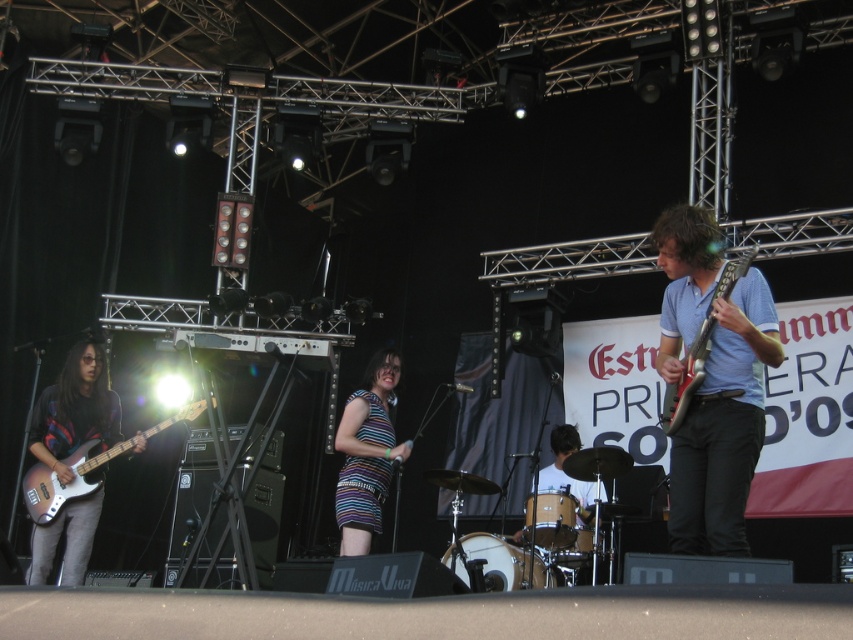
Question: Does metallic purple bass at left appear on the left side of matte black electric guitar at right?

Choices:
 (A) yes
 (B) no

Answer: (A)

Question: Which object appears farthest from the camera in this image?

Choices:
 (A) metallic purple bass at left
 (B) matte blue shirt at center

Answer: (A)

Question: Does matte blue shirt at center have a smaller size compared to striped fabric dress at center?

Choices:
 (A) yes
 (B) no

Answer: (B)

Question: Estimate the real-world distances between objects in this image. Which object is farther from the striped fabric dress at center?

Choices:
 (A) matte blue shirt at center
 (B) brushed metal bass guitar at left

Answer: (A)

Question: Is brushed metal bass guitar at left smaller than striped fabric dress at center?

Choices:
 (A) no
 (B) yes

Answer: (A)

Question: Which point is farther from the camera taking this photo?

Choices:
 (A) coord(45,522)
 (B) coord(683,385)
 (C) coord(372,358)
 (D) coord(91,545)

Answer: (D)